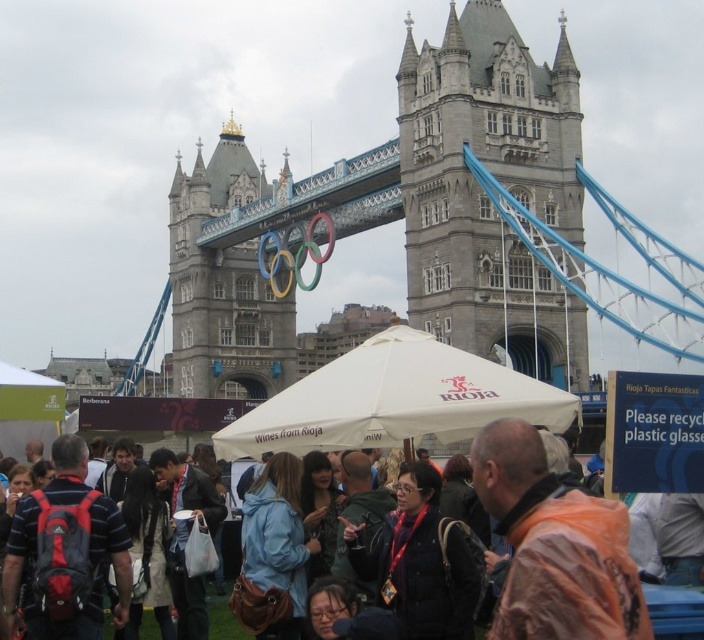
Consider the image. You are a photographer trying to capture a photo of the Olympic rings displayed on Tower Bridge. You have a matte black backpack at lower left and a striped fabric shirt at center in your frame. Which object should you move closer to the Olympic rings to ensure they are the main focus?

You should move the striped fabric shirt at center closer to the Olympic rings because the matte black backpack at lower left might be wider and could block the view of the Olympic rings more significantly.

You are a photographer trying to capture the stone gothic tower at center and the white fabric canopy at center in the same frame. Based on their positions, which object should you focus on first to ensure both are in the shot?

The stone gothic tower at center is positioned over the white fabric canopy at center, so you should focus on the stone gothic tower at center first to ensure both are in the shot.